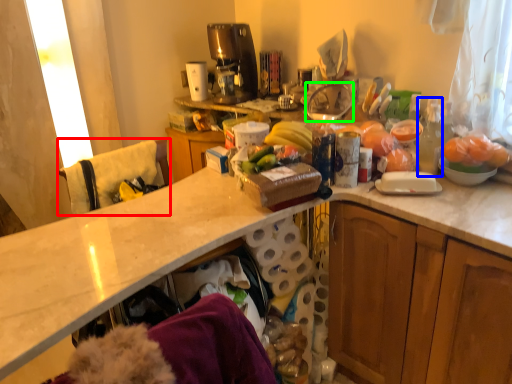
Question: Considering the real-world distances, which object is closest to leftover (highlighted by a red box)? bottle (highlighted by a blue box) or appliance (highlighted by a green box).

Choices:
 (A) bottle
 (B) appliance

Answer: (B)